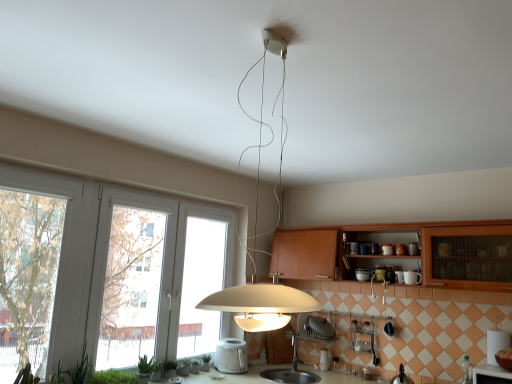
The width and height of the screenshot is (512, 384). What do you see at coordinates (324, 359) in the screenshot?
I see `white glossy toaster at center, the second appliance when ordered from left to right` at bounding box center [324, 359].

Describe the element at coordinates (404, 255) in the screenshot. The width and height of the screenshot is (512, 384). I see `wooden cabinet at center` at that location.

This screenshot has width=512, height=384. I want to click on green leafy plant at lower left, positioned as the 1th plant in front-to-back order, so click(26, 376).

Image resolution: width=512 pixels, height=384 pixels. In order to click on white glossy toaster at center, the second appliance when ordered from left to right in this screenshot , I will do `click(324, 359)`.

Considering the sizes of green matte plant at lower center, which appears as the 2th plant when viewed from the back, and green matte plant at lower left, which ranks as the fourth plant in right-to-left order, in the image, is green matte plant at lower center, which appears as the 2th plant when viewed from the back, taller or shorter than green matte plant at lower left, which ranks as the fourth plant in right-to-left order,?

In the image, green matte plant at lower center, which appears as the 2th plant when viewed from the back, appears to be shorter than green matte plant at lower left, which ranks as the fourth plant in right-to-left order.

From the image's perspective, would you say green matte plant at lower center, positioned as the 2th plant in right-to-left order, is shown under green matte plant at lower left, the 4th plant in the back-to-front sequence?

→ Yes, from the image's perspective, green matte plant at lower center, positioned as the 2th plant in right-to-left order, is beneath green matte plant at lower left, the 4th plant in the back-to-front sequence.

Can we say green matte plant at lower center, positioned as the 2th plant in right-to-left order, lies outside green matte plant at lower left, the third plant in the front-to-back sequence?

Yes, green matte plant at lower center, positioned as the 2th plant in right-to-left order, is not within green matte plant at lower left, the third plant in the front-to-back sequence.

Is green leafy plant at lower left, arranged as the 5th plant when viewed from the back, oriented away from white plastic window at left?

Yes, green leafy plant at lower left, arranged as the 5th plant when viewed from the back, is positioned with its back facing white plastic window at left.

Could you measure the distance between green leafy plant at lower left, arranged as the second plant when viewed from the front, and white plastic window at left?

green leafy plant at lower left, arranged as the second plant when viewed from the front, is 70.23 centimeters from white plastic window at left.

In the scene shown: From their relative heights in the image, would you say green leafy plant at lower left, the 2th plant from the left, is taller or shorter than white plastic window at left?

green leafy plant at lower left, the 2th plant from the left, is shorter than white plastic window at left.

Is point (57, 375) closer to camera compared to point (91, 290)?

Yes.

Is white plastic window at left located within green leafy plant at lower left, the fourth plant viewed from the left?

No.

Considering the positions of objects green leafy plant at lower left, which appears as the fourth plant when viewed from the front, and white plastic window at left in the image provided, who is behind, green leafy plant at lower left, which appears as the fourth plant when viewed from the front, or white plastic window at left?

green leafy plant at lower left, which appears as the fourth plant when viewed from the front, is further from the camera.

Which of these two, green leafy plant at lower left, the 3th plant when ordered from right to left, or white plastic window at left, stands shorter?

green leafy plant at lower left, the 3th plant when ordered from right to left.

Is green leafy plant at lower left, which ranks as the 3th plant in back-to-front order, turned away from white plastic window at left?

Yes, white plastic window at left is at the back of green leafy plant at lower left, which ranks as the 3th plant in back-to-front order.

Does green leafy plant at lower left, the 3th plant when ordered from right to left, have a greater width compared to wooden cabinet at center?

No, green leafy plant at lower left, the 3th plant when ordered from right to left, is not wider than wooden cabinet at center.

Is green leafy plant at lower left, which appears as the fourth plant when viewed from the front, aimed at wooden cabinet at center?

No.

Considering the relative sizes of green leafy plant at lower left, which ranks as the 3th plant in back-to-front order, and wooden cabinet at center in the image provided, is green leafy plant at lower left, which ranks as the 3th plant in back-to-front order, taller than wooden cabinet at center?

No, green leafy plant at lower left, which ranks as the 3th plant in back-to-front order, is not taller than wooden cabinet at center.

Which object is positioned more to the left, green leafy plant at lower left, which appears as the fourth plant when viewed from the front, or wooden cabinet at center?

Positioned to the left is green leafy plant at lower left, which appears as the fourth plant when viewed from the front.

Could you tell me if matte white pendant light at center is turned towards wooden cabinet at center?

No, matte white pendant light at center is not oriented towards wooden cabinet at center.

From the image's perspective, which one is positioned lower, matte white pendant light at center or wooden cabinet at center?

wooden cabinet at center, from the image's perspective.

Which object is closer to the camera taking this photo, matte white pendant light at center or wooden cabinet at center?

matte white pendant light at center is closer to the camera.

Is green leafy plant at lower left, placed as the sixth plant when sorted from back to front, bigger than metallic silver faucet at lower center?

No, green leafy plant at lower left, placed as the sixth plant when sorted from back to front, is not bigger than metallic silver faucet at lower center.

Does green leafy plant at lower left, placed as the first plant when sorted from left to right, come behind metallic silver faucet at lower center?

No, green leafy plant at lower left, placed as the first plant when sorted from left to right, is closer to the viewer.

From the image's perspective, between green leafy plant at lower left, placed as the first plant when sorted from left to right, and metallic silver faucet at lower center, who is located below?

metallic silver faucet at lower center.

Is green matte plant at lower center, which is the 5th plant from front to back, facing towards wooden cabinet at center?

No, green matte plant at lower center, which is the 5th plant from front to back, is not oriented towards wooden cabinet at center.

In terms of height, does green matte plant at lower center, which appears as the 2th plant when viewed from the back, look taller or shorter compared to wooden cabinet at center?

green matte plant at lower center, which appears as the 2th plant when viewed from the back, is shorter than wooden cabinet at center.

Is green matte plant at lower center, positioned as the 2th plant in right-to-left order, placed right next to wooden cabinet at center?

There is a gap between green matte plant at lower center, positioned as the 2th plant in right-to-left order, and wooden cabinet at center.

Considering the sizes of green matte plant at lower center, positioned as the 2th plant in right-to-left order, and wooden cabinet at center in the image, is green matte plant at lower center, positioned as the 2th plant in right-to-left order, wider or thinner than wooden cabinet at center?

Considering their sizes, green matte plant at lower center, positioned as the 2th plant in right-to-left order, looks slimmer than wooden cabinet at center.

At what (x,y) coordinates should I click in order to perform the action: click on plant that is the 3rd object located below the green matte plant at lower left, acting as the 3th plant starting from the left (from the image's perspective). Please return your answer as a coordinate pair (x, y). Looking at the image, I should click on (194, 366).

Identify the location of window above the green leafy plant at lower left, the 5th plant from the right (from the image's perspective). (105, 273).

Considering their positions, is green leafy plant at lower left, placed as the first plant when sorted from left to right, positioned closer to green matte plant at lower center, positioned as the 2th plant in right-to-left order, than matte white pendant light at center?

matte white pendant light at center is positioned closer to the anchor green matte plant at lower center, positioned as the 2th plant in right-to-left order.

Considering their positions, is matte white pendant light at center positioned further to wooden cabinet at center than metallic silver faucet at lower center?

Among the two, metallic silver faucet at lower center is located further to wooden cabinet at center.

Which object lies further to the anchor point green matte plant at lower left, which ranks as the fourth plant in right-to-left order, green leafy plant at lower left, the 5th plant from the right, or green leafy plant at lower left, which ranks as the 3th plant in back-to-front order?

green leafy plant at lower left, the 5th plant from the right, is further to green matte plant at lower left, which ranks as the fourth plant in right-to-left order.

Looking at the image, which one is located closer to matte white pendant light at center, white plastic toaster at center, the second appliance in the right-to-left sequence, or green leafy plant at lower left, which appears as the sixth plant when viewed from the right?

Based on the image, white plastic toaster at center, the second appliance in the right-to-left sequence, appears to be nearer to matte white pendant light at center.

Considering their positions, is green leafy plant at lower left, which appears as the sixth plant when viewed from the right, positioned further to white plastic window at left than green leafy plant at lower left, the 2th plant from the left?

The object further to white plastic window at left is green leafy plant at lower left, which appears as the sixth plant when viewed from the right.

Estimate the real-world distances between objects in this image. Which object is closer to white plastic toaster at center, the first appliance viewed from the left, metallic silver faucet at lower center or white glossy toaster at center, which appears as the 1th appliance when viewed from the right?

Among the two, metallic silver faucet at lower center is located nearer to white plastic toaster at center, the first appliance viewed from the left.

Estimate the real-world distances between objects in this image. Which object is further from matte white pendant light at center, white plastic window at left or green leafy plant at lower left, positioned as the 1th plant in front-to-back order?

The object further to matte white pendant light at center is green leafy plant at lower left, positioned as the 1th plant in front-to-back order.

Looking at the image, which one is located further to green leafy plant at lower left, placed as the first plant when sorted from left to right, white glossy toaster at center, the second appliance when ordered from left to right, or metallic silver faucet at lower center?

white glossy toaster at center, the second appliance when ordered from left to right, is further to green leafy plant at lower left, placed as the first plant when sorted from left to right.

Where is `appliance between white plastic toaster at center, the first appliance viewed from the left, and wooden cabinet at center from left to right`? The height and width of the screenshot is (384, 512). appliance between white plastic toaster at center, the first appliance viewed from the left, and wooden cabinet at center from left to right is located at coordinates (324, 359).

Image resolution: width=512 pixels, height=384 pixels. Identify the location of appliance located between matte white pendant light at center and white glossy toaster at center, the second appliance when ordered from left to right, in the depth direction. (231, 356).

Find the location of a particular element. This screenshot has width=512, height=384. lamp between green leafy plant at lower left, which appears as the sixth plant when viewed from the right, and wooden cabinet at center, in the horizontal direction is located at coordinates (260, 304).

This screenshot has width=512, height=384. I want to click on window between matte white pendant light at center and green matte plant at lower center, arranged as the fifth plant when viewed from the left, from front to back, so click(105, 273).